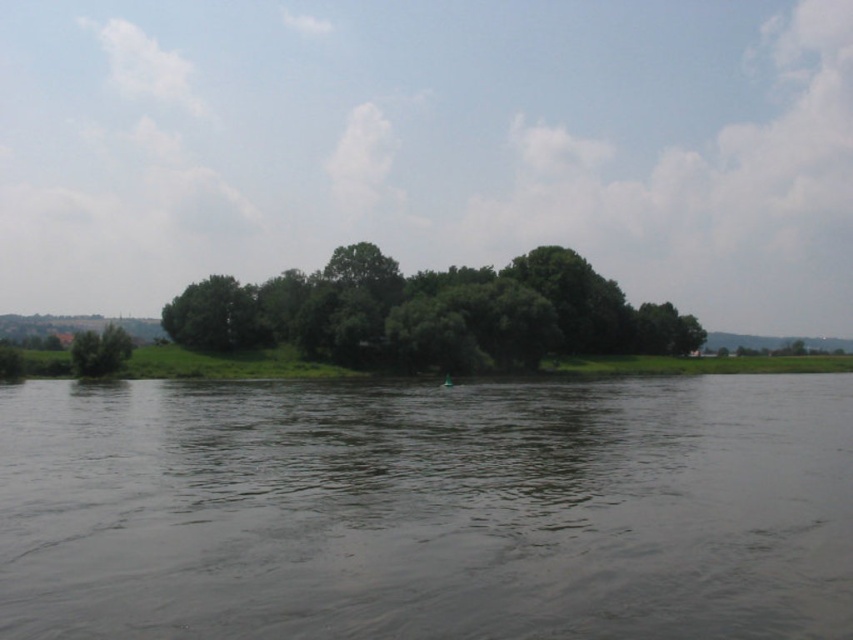
Who is lower down, brown murky water at center or green leafy tree at left?

brown murky water at center

Is brown murky water at center wider than green leafy tree at left?

In fact, brown murky water at center might be narrower than green leafy tree at left.

What do you see at coordinates (427, 509) in the screenshot? This screenshot has width=853, height=640. I see `brown murky water at center` at bounding box center [427, 509].

Where is `brown murky water at center`? The image size is (853, 640). brown murky water at center is located at coordinates (427, 509).

Is green leafy trees at center taller than green leafy tree at left?

Indeed, green leafy trees at center has a greater height compared to green leafy tree at left.

Can you confirm if green leafy trees at center is smaller than green leafy tree at left?

No, green leafy trees at center is not smaller than green leafy tree at left.

Is point (296, 298) less distant than point (120, 339)?

That is False.

You are a GUI agent. You are given a task and a screenshot of the screen. Output one action in this format:
    pyautogui.click(x=<x>, y=<y>)
    Task: Click on the green leafy trees at center
    The height and width of the screenshot is (640, 853).
    Given the screenshot: What is the action you would take?
    pyautogui.click(x=428, y=314)

Is point (3, 568) positioned in front of point (195, 326)?

Yes, point (3, 568) is closer to viewer.

Is brown murky water at center closer to the viewer compared to green leafy trees at center?

Yes, brown murky water at center is closer to the viewer.

Does point (293, 566) come in front of point (340, 285)?

That is True.

Find the location of a particular element. brown murky water at center is located at coordinates (427, 509).